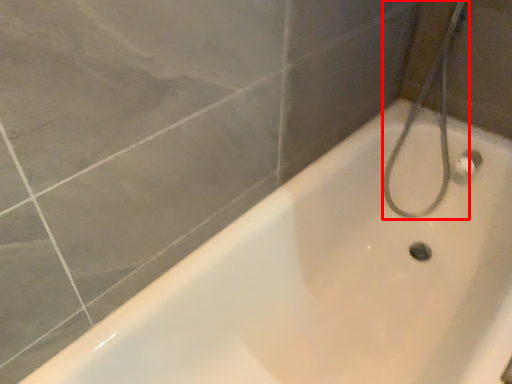
Question: From the image's perspective, what is the correct spatial positioning of shower (annotated by the red box) in reference to bathtub?

Choices:
 (A) below
 (B) above

Answer: (B)